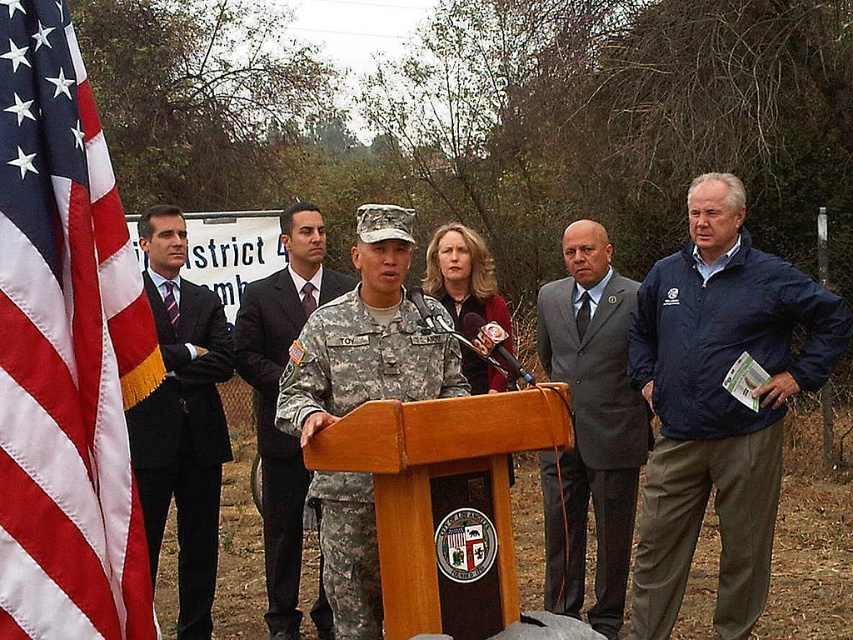
You are a photographer at the event and want to capture a photo of the speaker at the podium without any flag in the background. Given the position of the red white striped flag at left marked by point (65, 349), where should you position yourself to avoid it?

To avoid the red white striped flag at left marked by point (65, 349), position yourself to the right side of the speaker so the flag is out of frame.

You are a photographer at the press conference. You need to capture a clear photo of the speaker. Which object, the gray suit at center or the blonde hair at center, should you focus on to ensure the subject is in focus?

The gray suit at center is larger in size than blonde hair at center, so focusing on the gray suit at center will ensure the subject is in focus.

You are attending the press conference and need to locate the person in the black suit at left. According to the coordinates provided, where should you look in the image?

The black suit at left is located at point coordinates 0.655 on the x axis and 0.215 on the y axis.